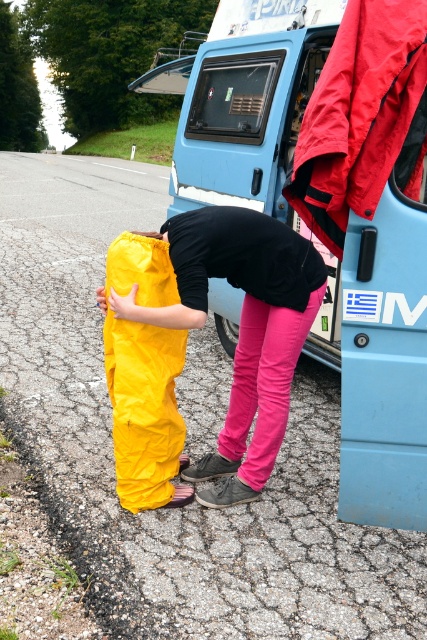
Question: Does blue matte van at center appear on the left side of yellow waterproof pants at lower left?

Choices:
 (A) yes
 (B) no

Answer: (A)

Question: Which object appears farthest from the camera in this image?

Choices:
 (A) yellow waterproof pants at lower left
 (B) blue matte van at center

Answer: (A)

Question: Does blue matte van at center have a greater width compared to yellow waterproof pants at center?

Choices:
 (A) yes
 (B) no

Answer: (A)

Question: Which object is positioned closest to the blue matte van at center?

Choices:
 (A) yellow waterproof pants at center
 (B) yellow waterproof pants at lower left

Answer: (A)

Question: Which object appears farthest from the camera in this image?

Choices:
 (A) yellow waterproof pants at center
 (B) yellow waterproof pants at lower left
 (C) blue matte van at center

Answer: (B)

Question: From the image, what is the correct spatial relationship of blue matte van at center in relation to yellow waterproof pants at center?

Choices:
 (A) right
 (B) left

Answer: (B)